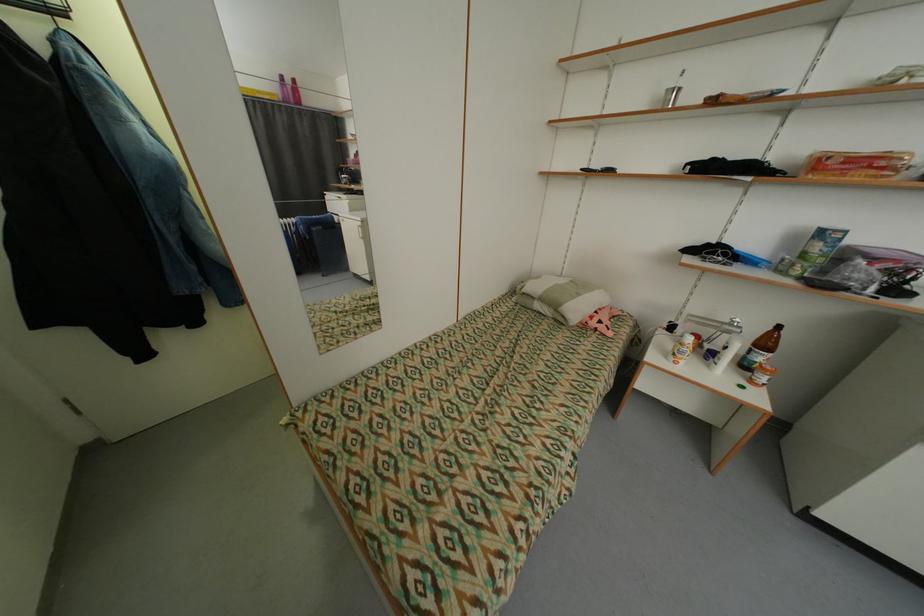
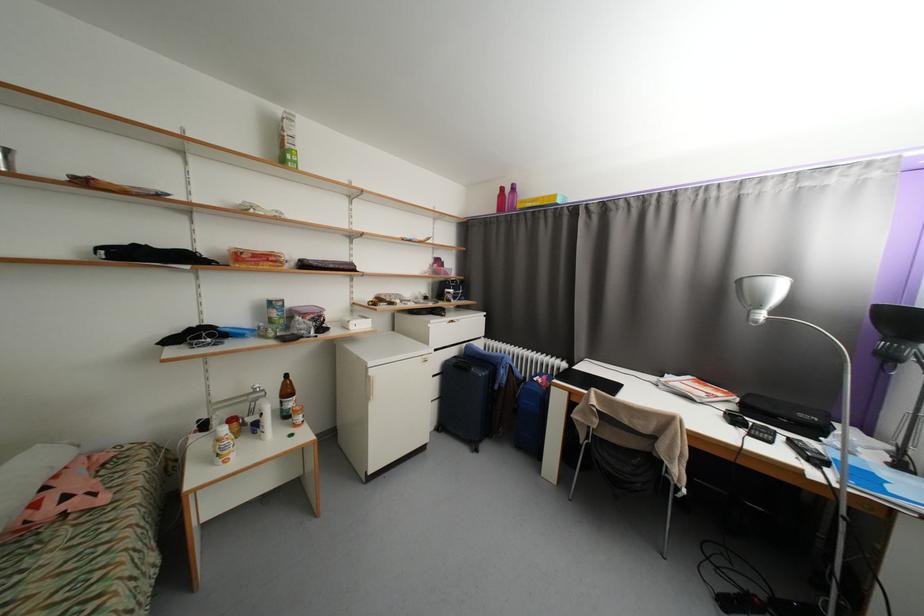
Locate, in the second image, the point that corresponds to pixel 772 345 in the first image.

(294, 392)